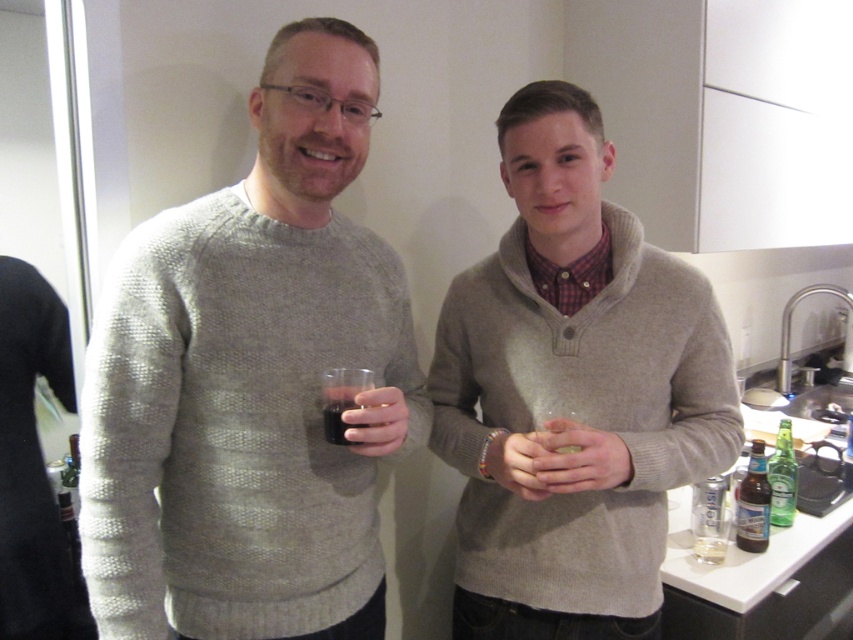
Question: Does knitted gray sweater at center appear over matte plastic cup at center?

Choices:
 (A) no
 (B) yes

Answer: (B)

Question: Is clear glass at center wider than brown glass bottle at lower right?

Choices:
 (A) yes
 (B) no

Answer: (A)

Question: Which point appears farthest from the camera in this image?

Choices:
 (A) (584, 237)
 (B) (751, 513)
 (C) (397, 413)
 (D) (209, 406)

Answer: (B)

Question: Which point appears farthest from the camera in this image?

Choices:
 (A) (795, 476)
 (B) (608, 625)
 (C) (548, 481)

Answer: (A)

Question: Is knitted gray sweater at center further to camera compared to clear glass at center?

Choices:
 (A) yes
 (B) no

Answer: (B)

Question: Which object appears closest to the camera in this image?

Choices:
 (A) clear glass at center
 (B) knitted gray sweater at center

Answer: (B)